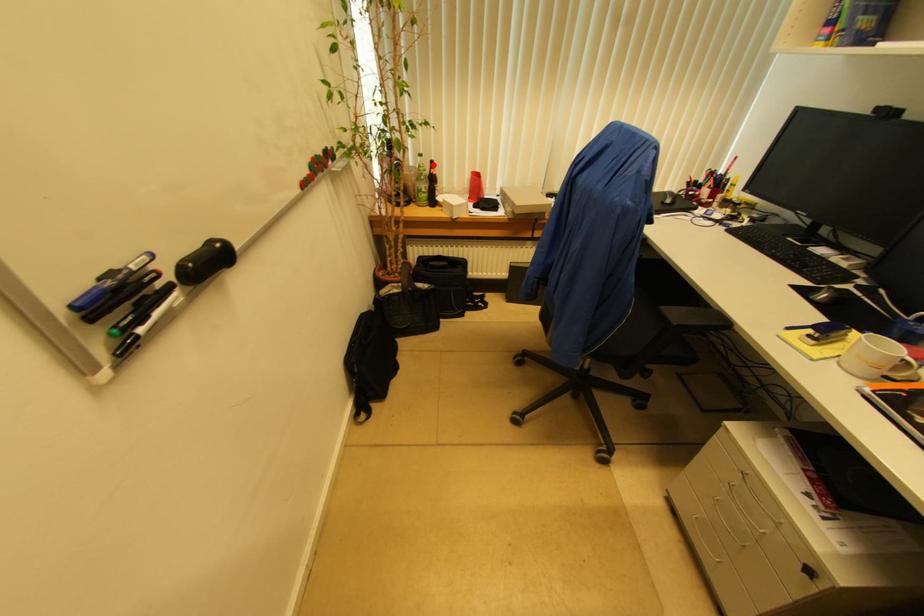
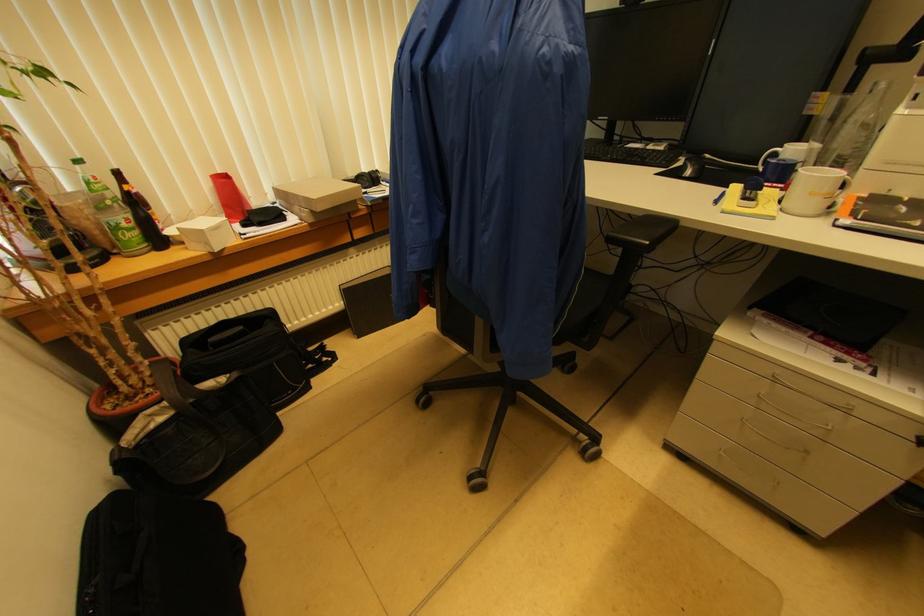
The point at the highlighted location is marked in the first image. Where is the corresponding point in the second image?

(118, 176)